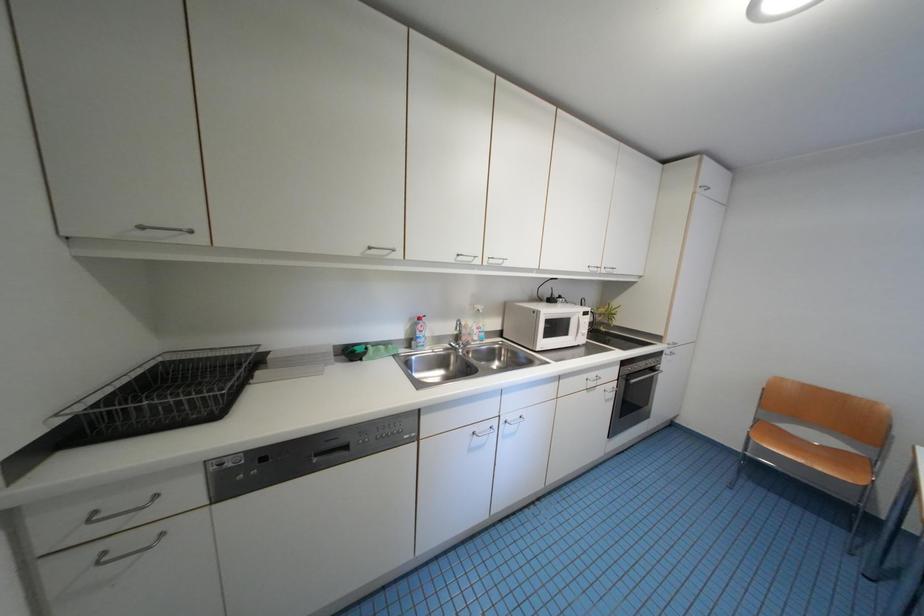
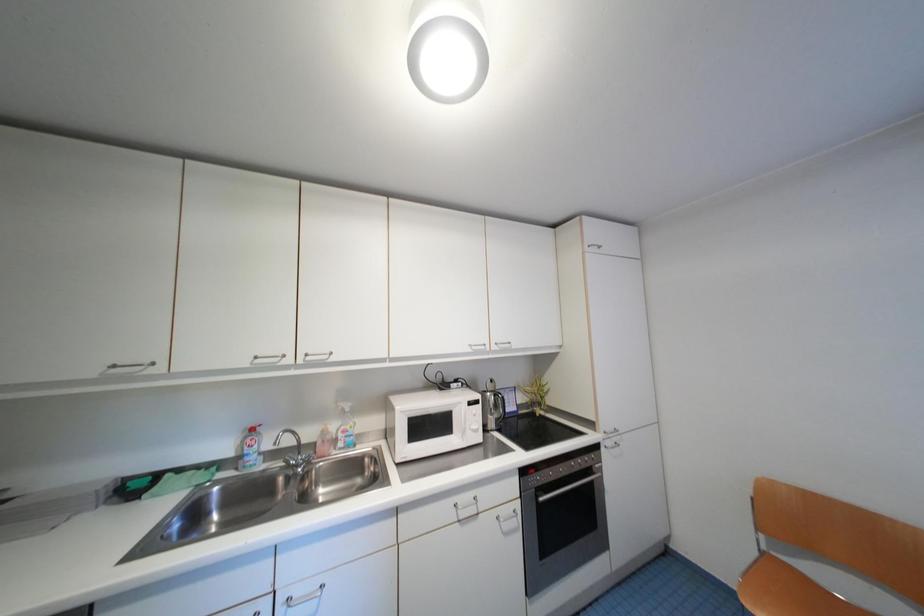
Question: The images are taken continuously from a first-person perspective. In which direction are you moving?

Choices:
 (A) Left
 (B) Right
 (C) Forward
 (D) Backward

Answer: (B)